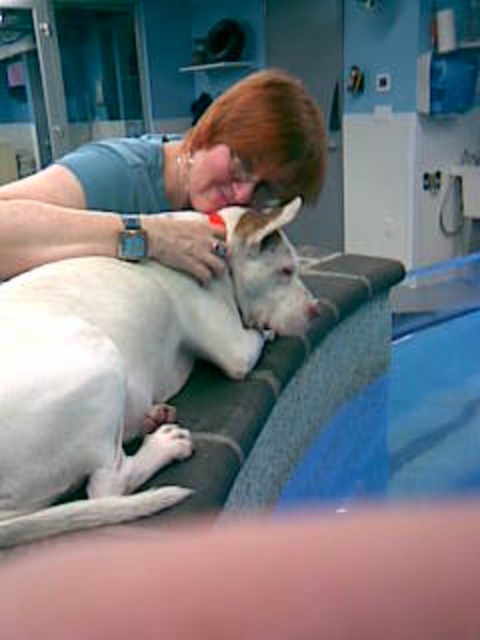
You are a photographer taking a picture of the white smooth dog at center and the matte gray shirt at upper center. Which object will appear larger in the photo?

The white smooth dog at center will appear larger in the photo because it is closer to the viewer than the matte gray shirt at upper center.

You are a veterinary assistant and need to determine the relative size of the white smooth dog at center compared to the matte gray shirt at upper center. Which one is taller?

The white smooth dog at center is much taller than the matte gray shirt at upper center.

You are a veterinarian examining the scene. You need to determine which object is larger between the white smooth dog at center and the matte gray shirt at upper center. Based on the scene, can you identify which one is bigger?

The white smooth dog at center is bigger than the matte gray shirt at upper center according to the description.